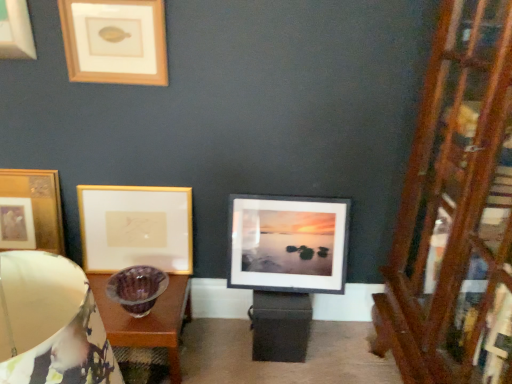
Question: Is wooden at right shorter than gold/matte picture frame at upper left, the 3th picture frame positioned from the left?

Choices:
 (A) yes
 (B) no

Answer: (B)

Question: Are wooden at right and gold/matte picture frame at upper left, the second picture frame from the right, located far from each other?

Choices:
 (A) no
 (B) yes

Answer: (B)

Question: Is wooden at right surrounding gold/matte picture frame at upper left, the 3th picture frame positioned from the left?

Choices:
 (A) yes
 (B) no

Answer: (B)

Question: Does wooden at right have a larger size compared to gold/matte picture frame at upper left, the second picture frame from the right?

Choices:
 (A) yes
 (B) no

Answer: (A)

Question: From the image's perspective, is wooden at right located beneath gold/matte picture frame at upper left, the 3th picture frame positioned from the left?

Choices:
 (A) yes
 (B) no

Answer: (A)

Question: From a real-world perspective, is gold metallic picture frame at upper left, which is counted as the 1th picture frame, starting from the left, physically located above or below matte purple glass bowl at left?

Choices:
 (A) below
 (B) above

Answer: (A)

Question: Is gold metallic picture frame at upper left, which is counted as the 1th picture frame, starting from the left, wider or thinner than matte purple glass bowl at left?

Choices:
 (A) wide
 (B) thin

Answer: (B)

Question: Do you think gold metallic picture frame at upper left, which is counted as the 1th picture frame, starting from the left, is within matte purple glass bowl at left, or outside of it?

Choices:
 (A) outside
 (B) inside

Answer: (A)

Question: Is point (24, 198) positioned closer to the camera than point (119, 375)?

Choices:
 (A) closer
 (B) farther

Answer: (B)

Question: Does point (398, 292) appear closer or farther from the camera than point (4, 233)?

Choices:
 (A) farther
 (B) closer

Answer: (B)

Question: Is wooden at right bigger or smaller than gold metallic picture frame at upper left, which is counted as the 1th picture frame, starting from the left?

Choices:
 (A) small
 (B) big

Answer: (B)

Question: Considering the positions of wooden at right and gold metallic picture frame at upper left, marked as the fourth picture frame in a right-to-left arrangement, in the image, is wooden at right taller or shorter than gold metallic picture frame at upper left, marked as the fourth picture frame in a right-to-left arrangement,?

Choices:
 (A) tall
 (B) short

Answer: (A)

Question: Based on their positions, is wooden at right located to the left or right of gold metallic picture frame at upper left, marked as the fourth picture frame in a right-to-left arrangement?

Choices:
 (A) left
 (B) right

Answer: (B)

Question: Is matte purple glass bowl at left taller or shorter than gold metallic picture frame at upper left, marked as the fourth picture frame in a right-to-left arrangement?

Choices:
 (A) short
 (B) tall

Answer: (A)

Question: Considering their positions, is matte purple glass bowl at left located in front of or behind gold metallic picture frame at upper left, which is counted as the 1th picture frame, starting from the left?

Choices:
 (A) front
 (B) behind

Answer: (A)